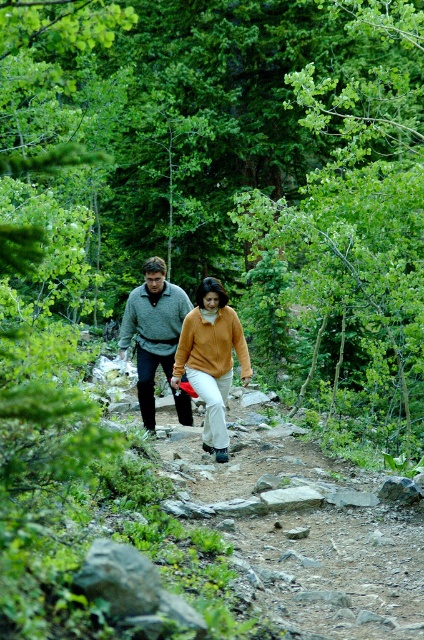
Question: Among these points, which one is nearest to the camera?

Choices:
 (A) (217, 458)
 (B) (128, 328)

Answer: (A)

Question: Where is matte orange sweater at center located in relation to knit sweater at center in the image?

Choices:
 (A) left
 (B) right

Answer: (B)

Question: Among these objects, which one is farthest from the camera?

Choices:
 (A) matte orange sweater at center
 (B) knit sweater at center

Answer: (B)

Question: Can you confirm if matte orange sweater at center is positioned below knit sweater at center?

Choices:
 (A) no
 (B) yes

Answer: (B)

Question: Is matte orange sweater at center further to camera compared to knit sweater at center?

Choices:
 (A) yes
 (B) no

Answer: (B)